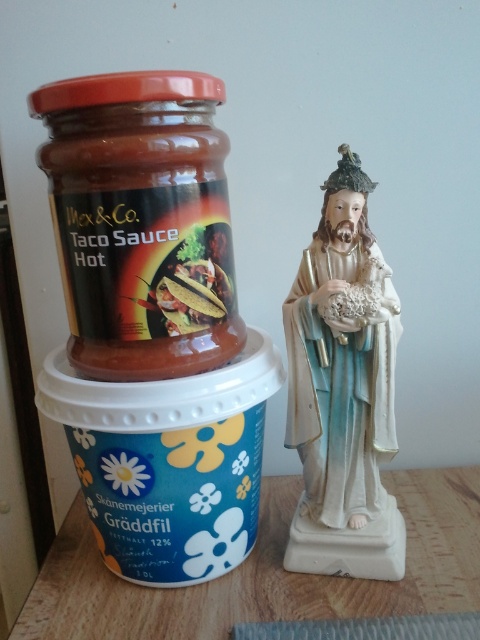
You are setting up a dinner table and need to place a vase between the matte glass jar at left and the wooden table at center. Where should you place the vase?

The vase should be placed between the matte glass jar at left and the wooden table at center since the matte glass jar at left is to the left of wooden table at center.

What is the spatial relationship between the wooden table at center and the red plastic lid at upper left in terms of width?

Answer: The wooden table at center is wider than the red plastic lid at upper left.

You are a delivery robot with a 15 inch wide package. You need to place it between the matte glass jar at left and the wooden table at center. Is there enough space?

The distance between the matte glass jar at left and the wooden table at center is 18.45 inches. Since the package is 15 inches wide, there is enough space to place it between them.